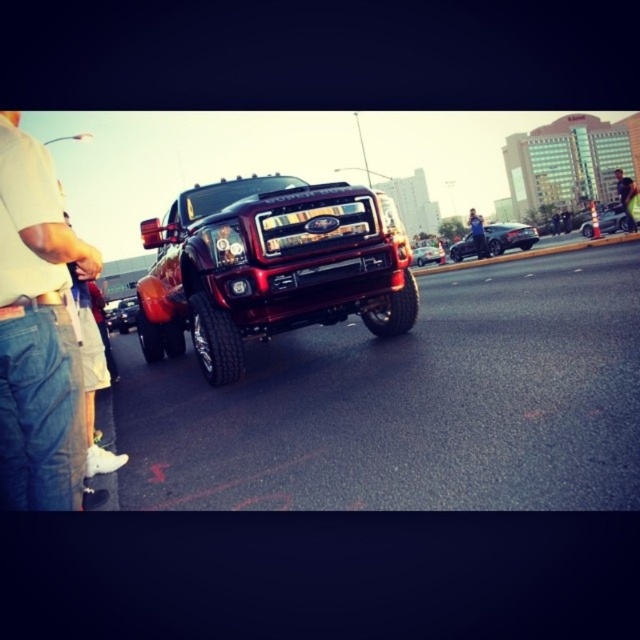
Is shiny chrome truck at center above glossy chrome car at center?

Incorrect, shiny chrome truck at center is not positioned above glossy chrome car at center.

Which is behind, point (362, 228) or point (419, 250)?

Positioned behind is point (419, 250).

At what (x,y) coordinates should I click in order to perform the action: click on shiny chrome truck at center. Please return your answer as a coordinate pair (x, y). The image size is (640, 640). Looking at the image, I should click on (269, 268).

Who is positioned more to the left, glossy red truck at center or denim jacket at center?

Positioned to the left is denim jacket at center.

Is glossy red truck at center bigger than denim jacket at center?

Actually, glossy red truck at center might be smaller than denim jacket at center.

Who is more distant from viewer, (612, 216) or (476, 236)?

Point (612, 216)

You are a GUI agent. You are given a task and a screenshot of the screen. Output one action in this format:
    pyautogui.click(x=<x>, y=<y>)
    Task: Click on the glossy red truck at center
    
    Given the screenshot: What is the action you would take?
    pyautogui.click(x=612, y=220)

Does metallic red truck at center appear on the right side of smooth leather jacket at center?

In fact, metallic red truck at center is to the left of smooth leather jacket at center.

Who is taller, metallic red truck at center or smooth leather jacket at center?

With more height is smooth leather jacket at center.

Who is more forward, [129,317] or [630,216]?

Point [630,216] is more forward.

Where is `metallic red truck at center`? metallic red truck at center is located at coordinates (122, 314).